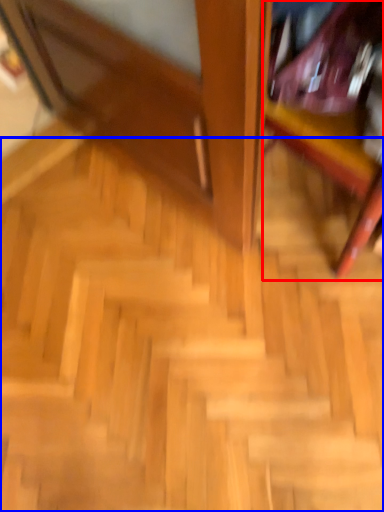
Question: Among these objects, which one is nearest to the camera, furniture (highlighted by a red box) or stairs (highlighted by a blue box)?

Choices:
 (A) furniture
 (B) stairs

Answer: (A)